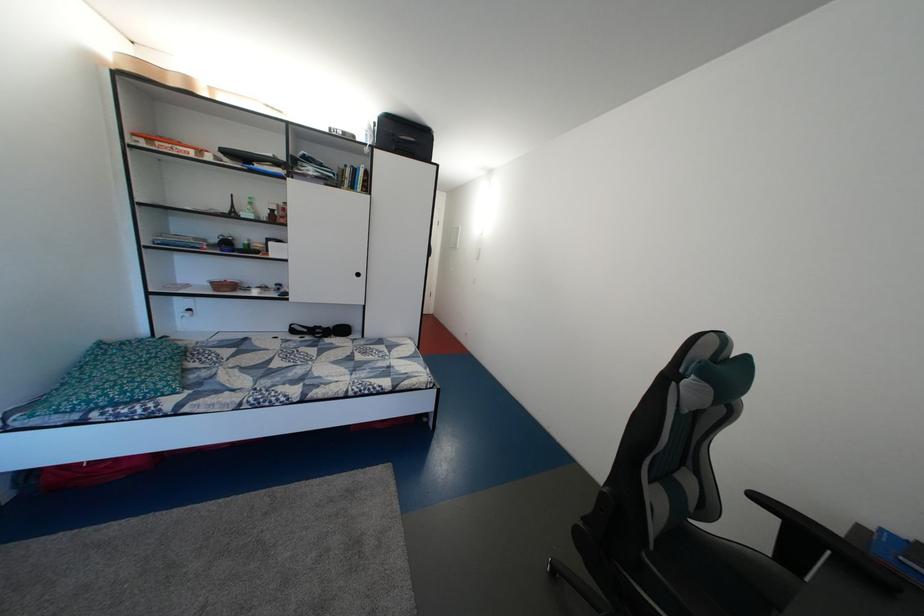
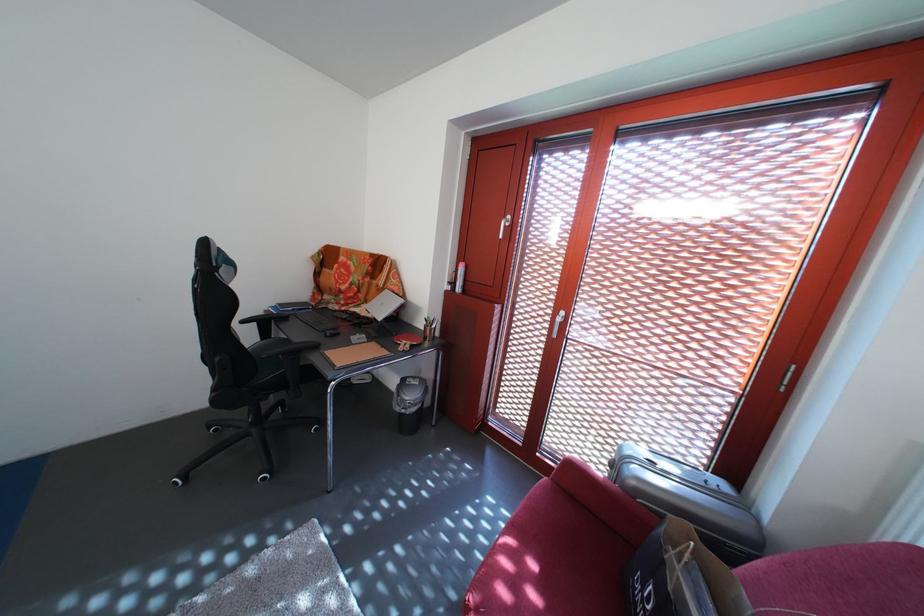
First-person continuous shooting, in which direction is the camera rotating?

The camera's rotation is toward right-down.